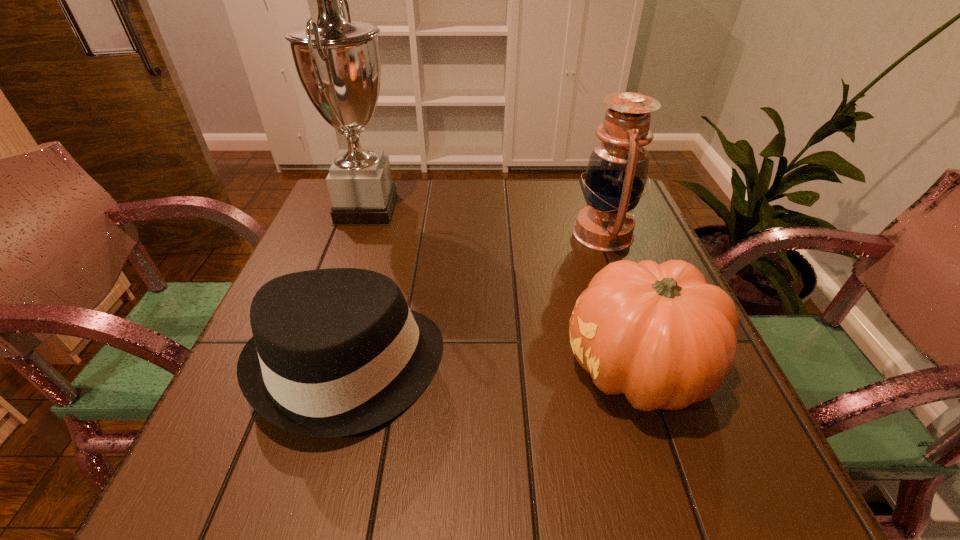
At what (x,y) coordinates should I click in order to perform the action: click on trophy cup that is positioned at the far edge. Please return your answer as a coordinate pair (x, y). The width and height of the screenshot is (960, 540). Looking at the image, I should click on (338, 62).

Locate an element on the screen. This screenshot has height=540, width=960. oil lamp that is at the far edge is located at coordinates (617, 171).

This screenshot has width=960, height=540. In order to click on object positioned at the near edge in this screenshot , I will do `click(335, 352)`.

Image resolution: width=960 pixels, height=540 pixels. In order to click on trophy cup that is at the left edge in this screenshot , I will do `click(338, 62)`.

This screenshot has height=540, width=960. Find the location of `fedora present at the left edge`. fedora present at the left edge is located at coordinates pos(335,352).

You are a GUI agent. You are given a task and a screenshot of the screen. Output one action in this format:
    pyautogui.click(x=<x>, y=<y>)
    Task: Click on the oil lamp that is at the right edge
    The image size is (960, 540).
    Given the screenshot: What is the action you would take?
    pyautogui.click(x=617, y=171)

Where is `pumpkin that is at the right edge`? This screenshot has width=960, height=540. pumpkin that is at the right edge is located at coordinates (658, 333).

This screenshot has width=960, height=540. I want to click on object present at the far left corner, so (338, 62).

This screenshot has height=540, width=960. Identify the location of object that is at the near left corner. (335, 352).

Where is `object located in the far right corner section of the desktop`? object located in the far right corner section of the desktop is located at coordinates (617, 171).